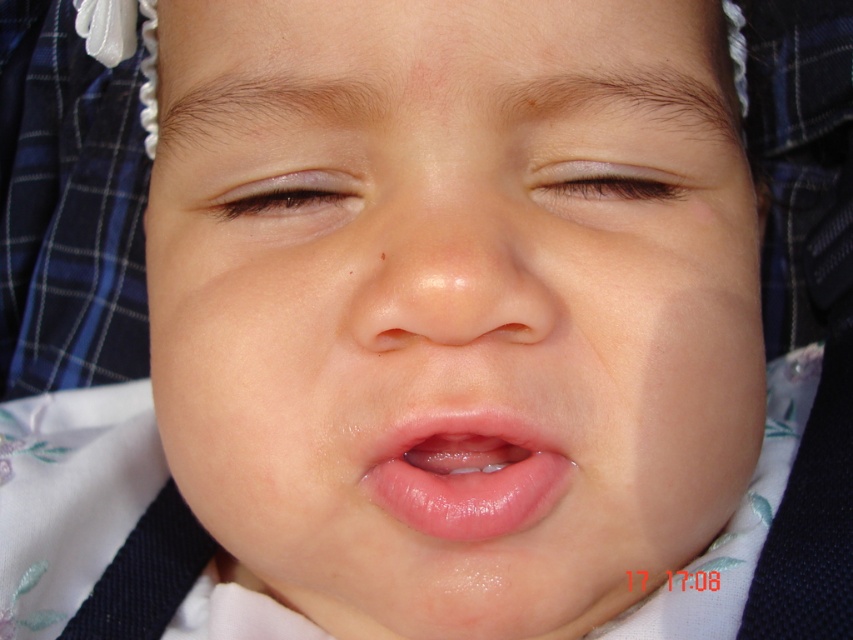
Based on the photo, does smooth skin face at center appear under smooth flesh-colored nose at center?

Yes.

Between point (219, 132) and point (434, 289), which one is positioned behind?

Positioned behind is point (219, 132).

Identify the location of smooth skin face at center. click(x=451, y=308).

Does smooth flesh-colored nose at center have a smaller size compared to glossy skin at upper center?

No.

Measure the distance between point (416, 337) and camera.

They are 11.36 inches apart.

At what (x,y) coordinates should I click in order to perform the action: click on smooth flesh-colored nose at center. Please return your answer as a coordinate pair (x, y). The image size is (853, 640). Looking at the image, I should click on (445, 266).

Looking at this image, measure the distance between smooth flesh-colored nose at center and glossy pink lips at center.

smooth flesh-colored nose at center is 1.78 inches away from glossy pink lips at center.

Can you confirm if smooth flesh-colored nose at center is bigger than glossy pink lips at center?

Correct, smooth flesh-colored nose at center is larger in size than glossy pink lips at center.

What do you see at coordinates (445, 266) in the screenshot?
I see `smooth flesh-colored nose at center` at bounding box center [445, 266].

The image size is (853, 640). What are the coordinates of `smooth flesh-colored nose at center` in the screenshot? It's located at (445, 266).